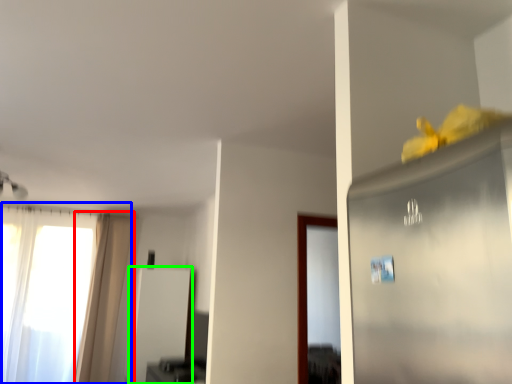
Question: Which object is the closest to the curtain (highlighted by a red box)? Choose among these: window (highlighted by a blue box) or screen door (highlighted by a green box).

Choices:
 (A) window
 (B) screen door

Answer: (A)